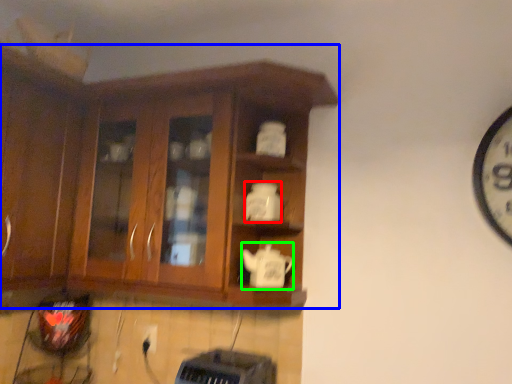
Question: Based on their relative distances, which object is farther from teapot (highlighted by a red box)? Choose from cabinetry (highlighted by a blue box) and teapot (highlighted by a green box).

Choices:
 (A) cabinetry
 (B) teapot

Answer: (A)